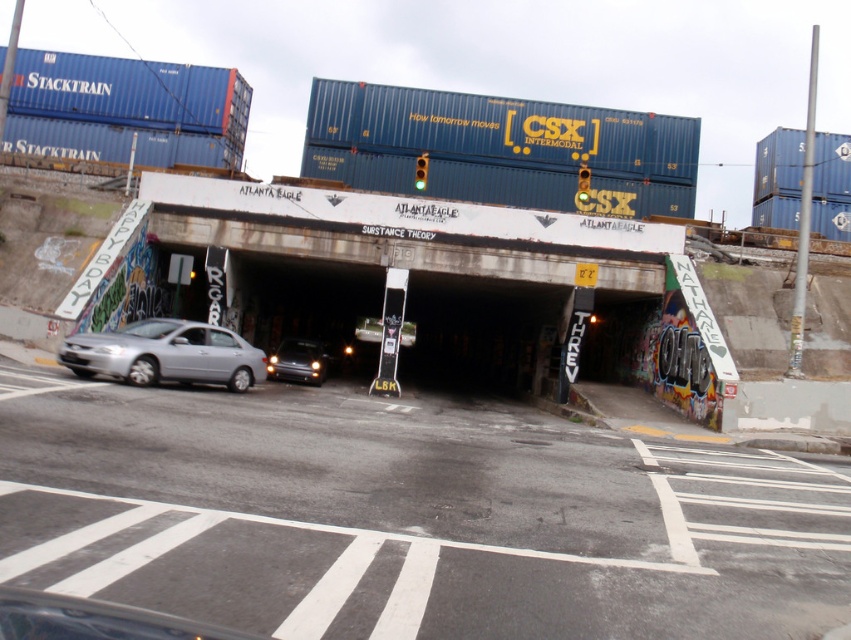
Question: Can you confirm if blue matte container at upper left is bigger than shiny silver sedan at lower left?

Choices:
 (A) no
 (B) yes

Answer: (B)

Question: Estimate the real-world distances between objects in this image. Which object is closer to the rusty metal overpass at center?

Choices:
 (A) blue matte container at upper left
 (B) blue matte shipping container at upper right
 (C) blue matte shipping container at upper center

Answer: (C)

Question: Which object is positioned closest to the blue matte shipping container at upper right?

Choices:
 (A) blue matte container at upper left
 (B) rusty metal overpass at center

Answer: (B)

Question: Does silver metallic car at lower left appear on the left side of blue matte shipping container at upper right?

Choices:
 (A) yes
 (B) no

Answer: (A)

Question: Is silver metallic car at lower left to the right of shiny silver sedan at lower left from the viewer's perspective?

Choices:
 (A) yes
 (B) no

Answer: (B)

Question: Which object is farther from the camera taking this photo?

Choices:
 (A) shiny silver sedan at lower left
 (B) blue matte container at upper left

Answer: (A)